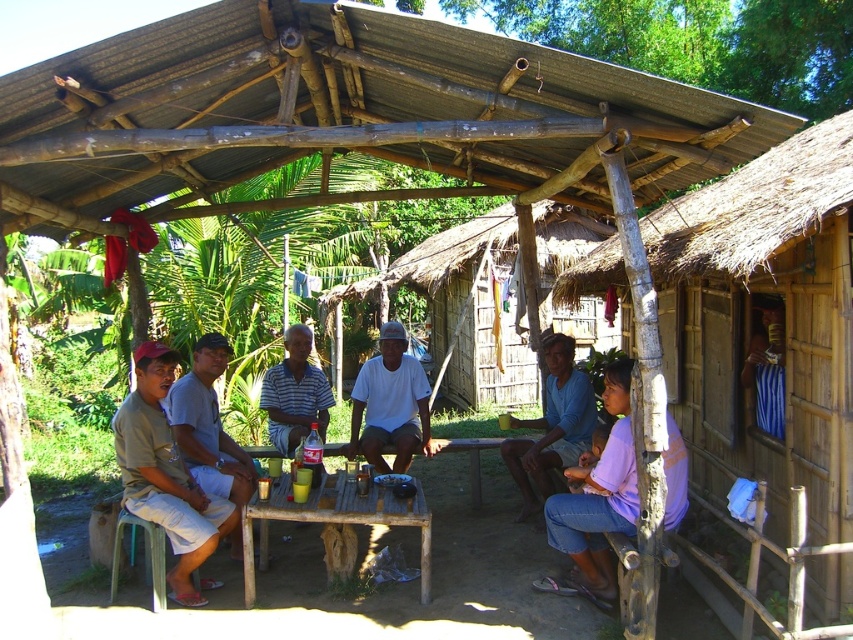
At what (x,y) coordinates should I click in order to perform the action: click on blue cotton shirt at center. Please return your answer as a coordinate pair (x, y). This screenshot has width=853, height=640. Looking at the image, I should click on (552, 426).

Can you confirm if blue cotton shirt at center is positioned to the right of striped fabric shirt at center?

Yes, blue cotton shirt at center is to the right of striped fabric shirt at center.

At what (x,y) coordinates should I click in order to perform the action: click on blue cotton shirt at center. Please return your answer as a coordinate pair (x, y). Image resolution: width=853 pixels, height=640 pixels. Looking at the image, I should click on (552, 426).

Is thatched wood hut at right positioned at the back of wooden table at center?

No, thatched wood hut at right is closer to the viewer.

Can you confirm if thatched wood hut at right is positioned to the right of wooden table at center?

Indeed, thatched wood hut at right is positioned on the right side of wooden table at center.

Is point (782, 253) positioned after point (247, 518)?

No, it is not.

Find the location of a particular element. This screenshot has width=853, height=640. thatched wood hut at right is located at coordinates (764, 330).

How much distance is there between white matte shirt at center and striped fabric shirt at center?

48.76 centimeters

Does white matte shirt at center have a larger size compared to striped fabric shirt at center?

Correct, white matte shirt at center is larger in size than striped fabric shirt at center.

Where is `white matte shirt at center`? The image size is (853, 640). white matte shirt at center is located at coordinates (390, 404).